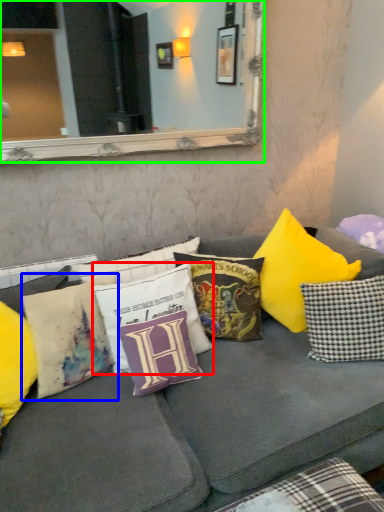
Question: Which object is positioned farthest from pillow (highlighted by a red box)? Select from pillow (highlighted by a blue box) and mirror (highlighted by a green box).

Choices:
 (A) pillow
 (B) mirror

Answer: (B)